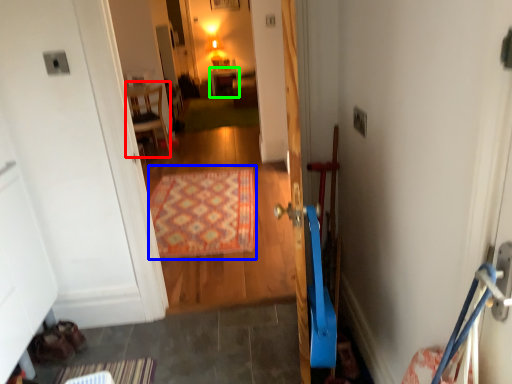
Question: Which is farther away from furniture (highlighted by a red box)? doormat (highlighted by a blue box) or furniture (highlighted by a green box)?

Choices:
 (A) doormat
 (B) furniture

Answer: (B)